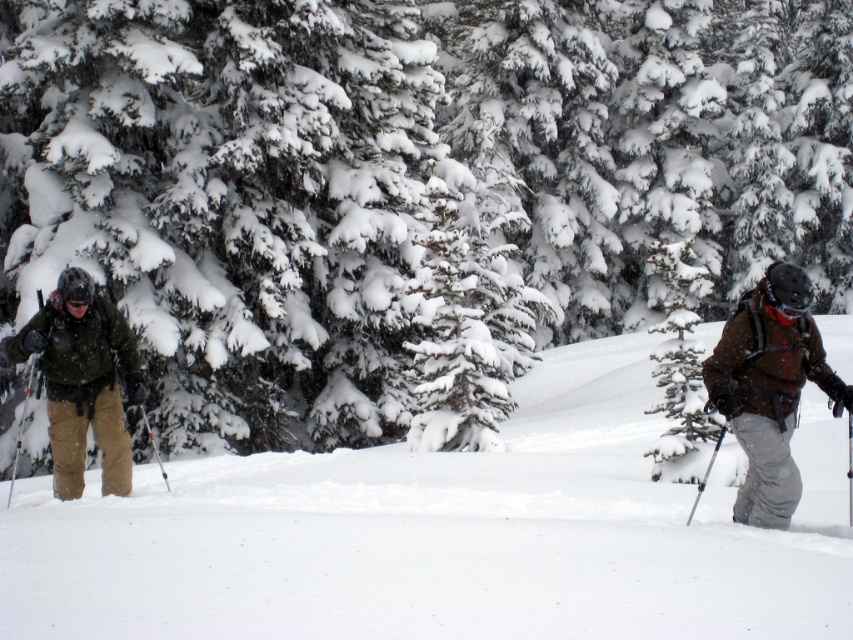
Can you confirm if white snow ski slope at left is thinner than matte green jacket at left?

No, white snow ski slope at left is not thinner than matte green jacket at left.

Which is more to the left, white snow ski slope at left or matte green jacket at left?

Positioned to the left is matte green jacket at left.

This screenshot has height=640, width=853. Find the location of `white snow ski slope at left`. white snow ski slope at left is located at coordinates (444, 534).

Which is more to the right, white snow ski slope at left or brown woolen jacket at right?

brown woolen jacket at right

Can you confirm if white snow ski slope at left is wider than brown woolen jacket at right?

Yes.

Identify the location of white snow ski slope at left. (444, 534).

Does brown woolen jacket at right have a larger size compared to matte green jacket at left?

Yes.

Between point (780, 321) and point (48, 392), which one is positioned behind?

Point (48, 392)

This screenshot has height=640, width=853. In order to click on brown woolen jacket at right in this screenshot , I will do point(769,387).

Find the location of a particular element. This screenshot has height=640, width=853. brown woolen jacket at right is located at coordinates (769, 387).